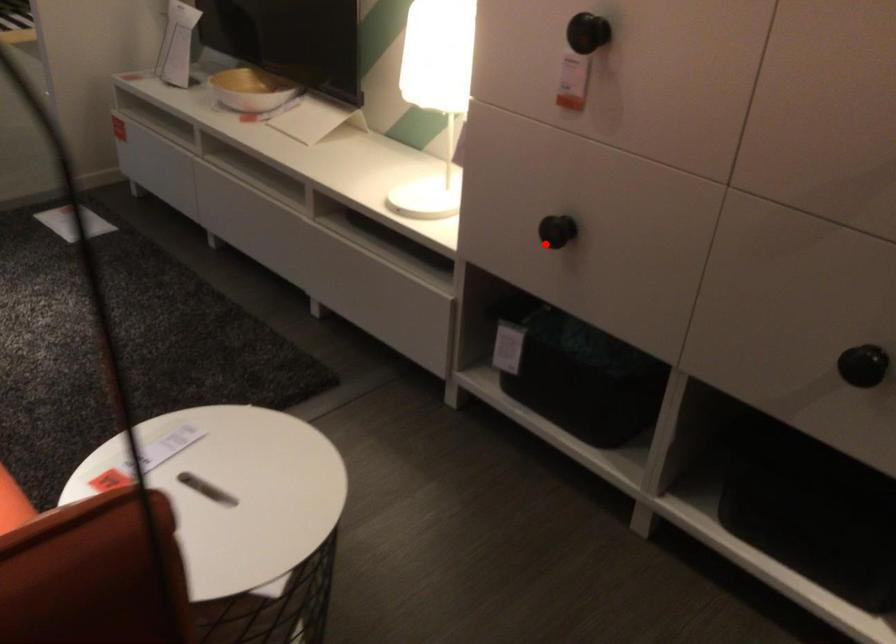
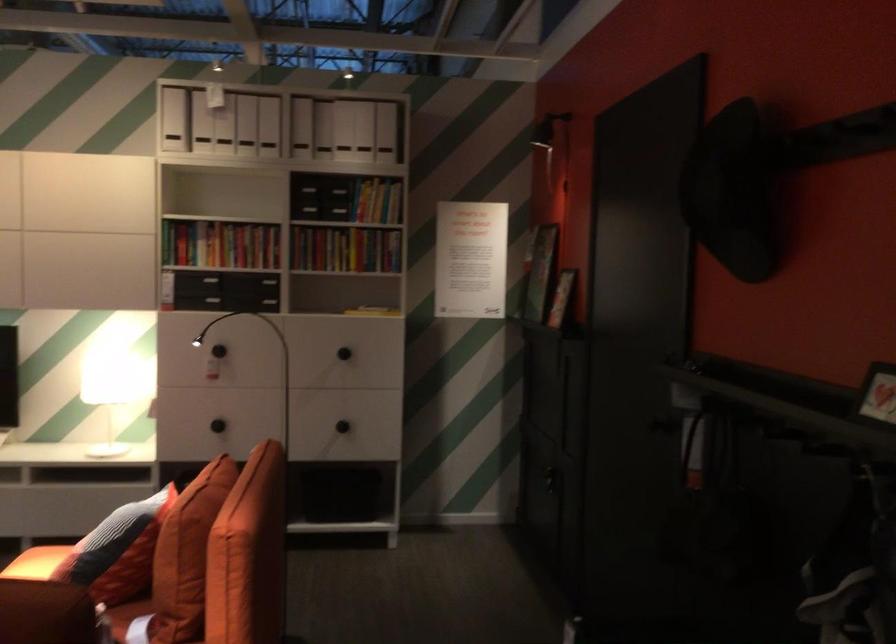
Find the pixel in the second image that matches the highlighted location in the first image.

(218, 426)